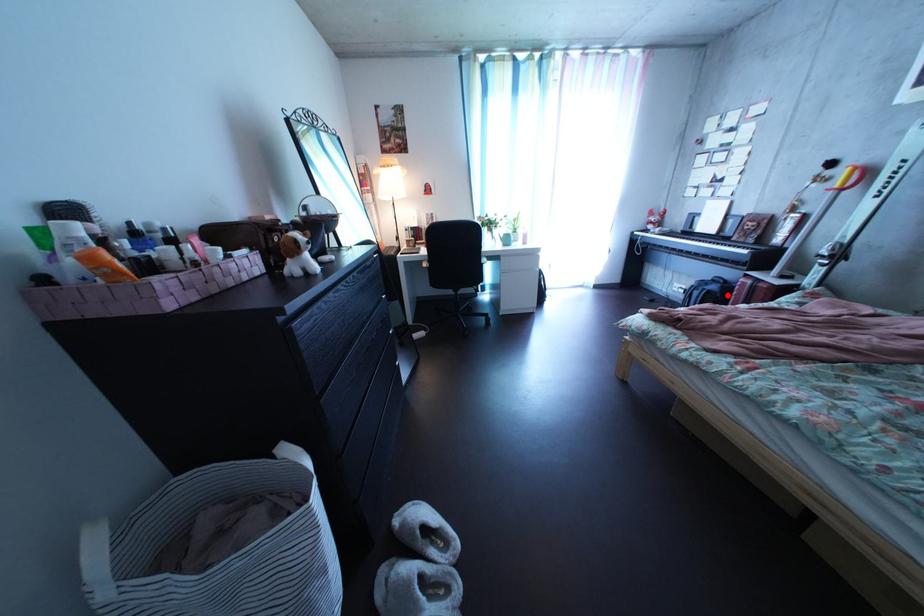
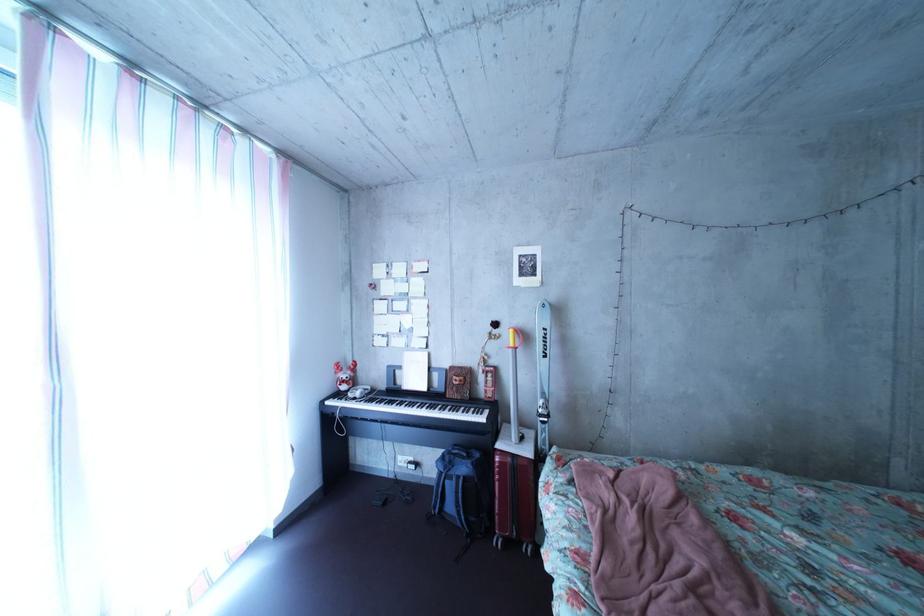
Find the pixel in the second image that matches the highlighted location in the first image.

(479, 477)